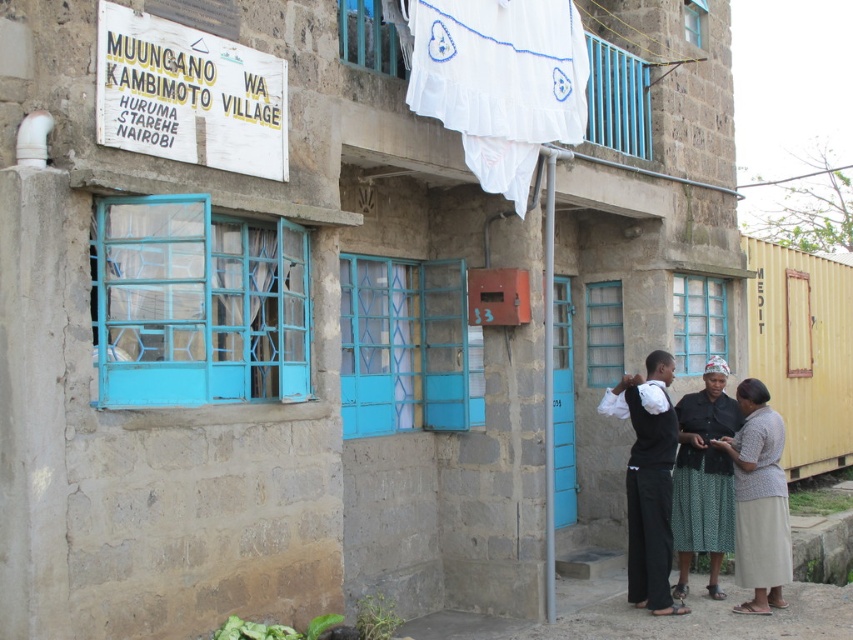
Question: Among these points, which one is nearest to the camera?

Choices:
 (A) (700, 420)
 (B) (567, 115)
 (C) (750, 547)

Answer: (B)

Question: Which point is closer to the camera?

Choices:
 (A) dark green textured skirt at center
 (B) white textured skirt at lower right
 (C) white fabric at upper center
 (D) black matte pants at lower center

Answer: (C)

Question: Can you confirm if white fabric at upper center is bigger than black matte pants at lower center?

Choices:
 (A) no
 (B) yes

Answer: (B)

Question: Is white fabric at upper center positioned at the back of dark green textured skirt at center?

Choices:
 (A) no
 (B) yes

Answer: (A)

Question: Estimate the real-world distances between objects in this image. Which object is farther from the dark green textured skirt at center?

Choices:
 (A) black matte pants at lower center
 (B) white fabric at upper center

Answer: (B)

Question: Does white fabric at upper center have a lesser width compared to black matte pants at lower center?

Choices:
 (A) no
 (B) yes

Answer: (A)